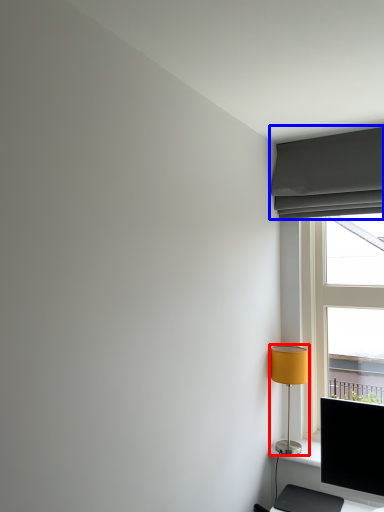
Question: Among these objects, which one is farthest to the camera, lamp (highlighted by a red box) or curtain (highlighted by a blue box)?

Choices:
 (A) lamp
 (B) curtain

Answer: (A)